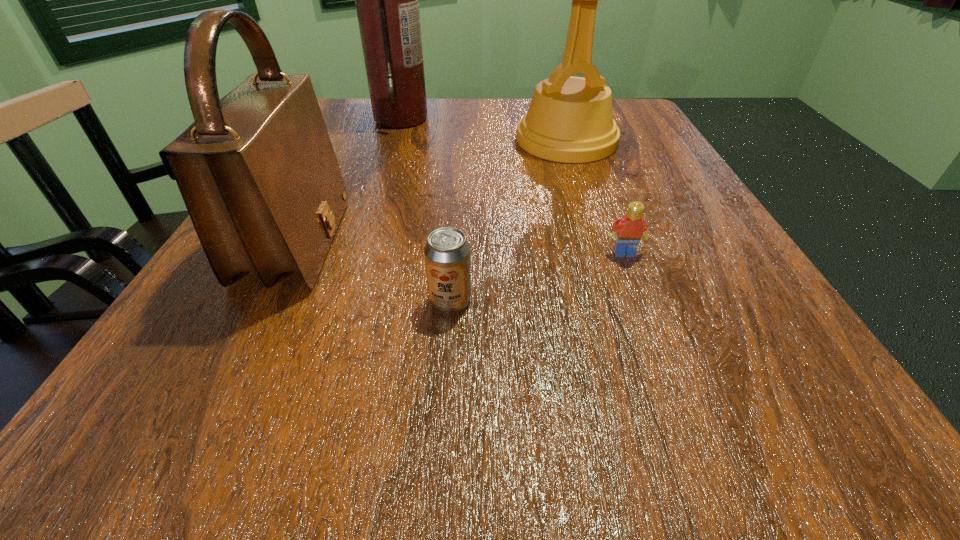
The width and height of the screenshot is (960, 540). What are the coordinates of `fire extinguisher present at the far edge` in the screenshot? It's located at (387, 0).

The image size is (960, 540). Find the location of `award that is at the far edge`. award that is at the far edge is located at coordinates (570, 119).

You are a GUI agent. You are given a task and a screenshot of the screen. Output one action in this format:
    pyautogui.click(x=<x>, y=<y>)
    Task: Click on the fire extinguisher that is at the left edge
    
    Given the screenshot: What is the action you would take?
    pyautogui.click(x=387, y=0)

You are a GUI agent. You are given a task and a screenshot of the screen. Output one action in this format:
    pyautogui.click(x=<x>, y=<y>)
    Task: Click on the shoulder bag that is at the left edge
    The height and width of the screenshot is (540, 960).
    Given the screenshot: What is the action you would take?
    pyautogui.click(x=257, y=171)

Where is `award at the right edge`? This screenshot has height=540, width=960. award at the right edge is located at coordinates (570, 119).

Locate an element on the screen. Lego that is at the right edge is located at coordinates (630, 228).

What are the coordinates of `object that is at the far left corner` in the screenshot? It's located at (387, 0).

Where is `object that is at the far right corner`? object that is at the far right corner is located at coordinates (570, 119).

Image resolution: width=960 pixels, height=540 pixels. Find the location of `free spot at the left edge of the desktop`. free spot at the left edge of the desktop is located at coordinates point(348,162).

The width and height of the screenshot is (960, 540). What are the coordinates of `free space at the right edge of the desktop` in the screenshot? It's located at (653, 172).